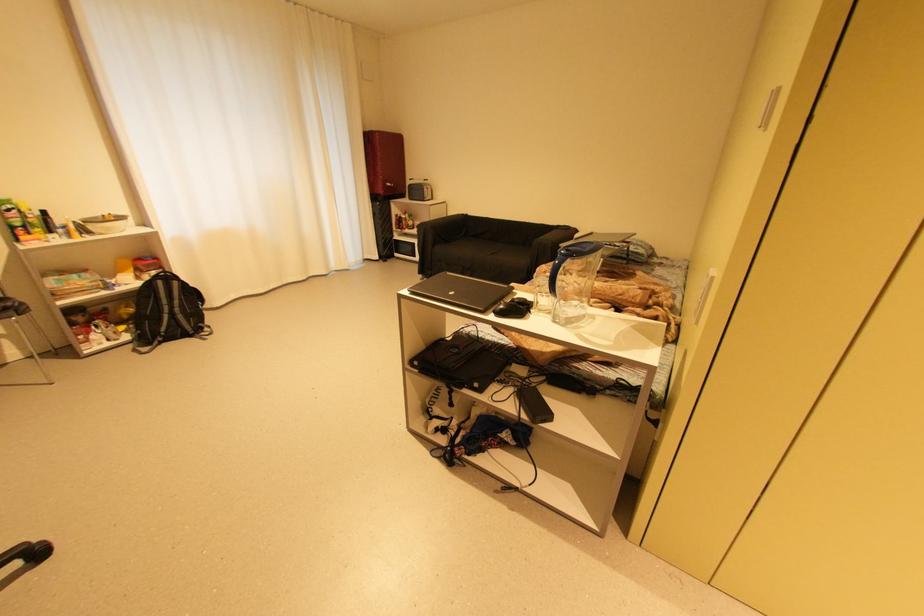
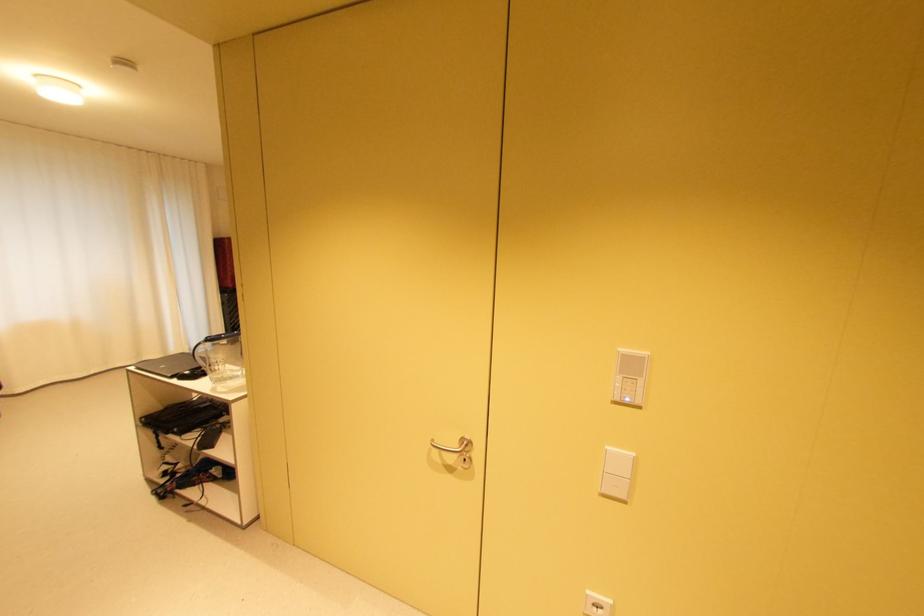
Find the pixel in the second image that matches [385,262] in the first image.

(234, 346)